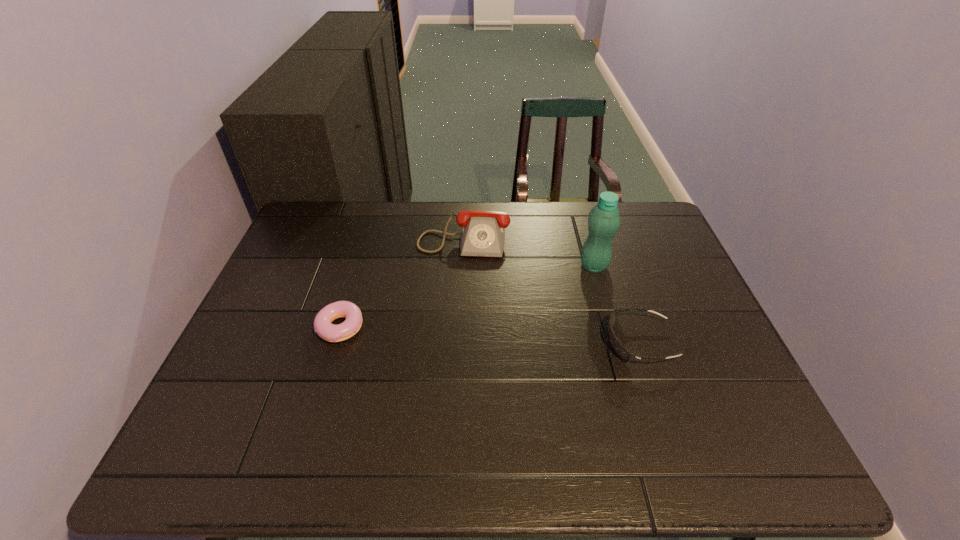
Find the location of `vacant space located 0.210m at the front cap of the tallest object`. vacant space located 0.210m at the front cap of the tallest object is located at coordinates (540, 312).

The image size is (960, 540). Find the location of `free space located 0.260m at the front cap of the tallest object`. free space located 0.260m at the front cap of the tallest object is located at coordinates (528, 322).

This screenshot has height=540, width=960. I want to click on vacant position located 0.070m at the front cap of the tallest object, so click(571, 285).

At what (x,y) coordinates should I click in order to perform the action: click on vacant area situated 0.130m on the dial of the telephone. Please return your answer as a coordinate pair (x, y). Looking at the image, I should click on (456, 291).

The image size is (960, 540). I want to click on vacant point located 0.070m on the dial of the telephone, so click(458, 276).

Image resolution: width=960 pixels, height=540 pixels. What are the coordinates of `vacant area situated 0.060m on the dial of the telephone` in the screenshot? It's located at (458, 273).

Identify the location of object that is at the far edge. Image resolution: width=960 pixels, height=540 pixels. (483, 232).

I want to click on object that is at the right edge, so click(x=616, y=345).

Find the location of a particular element. vacant position at the far edge of the desktop is located at coordinates (514, 240).

The height and width of the screenshot is (540, 960). Find the location of `free space at the near edge of the desktop`. free space at the near edge of the desktop is located at coordinates (636, 396).